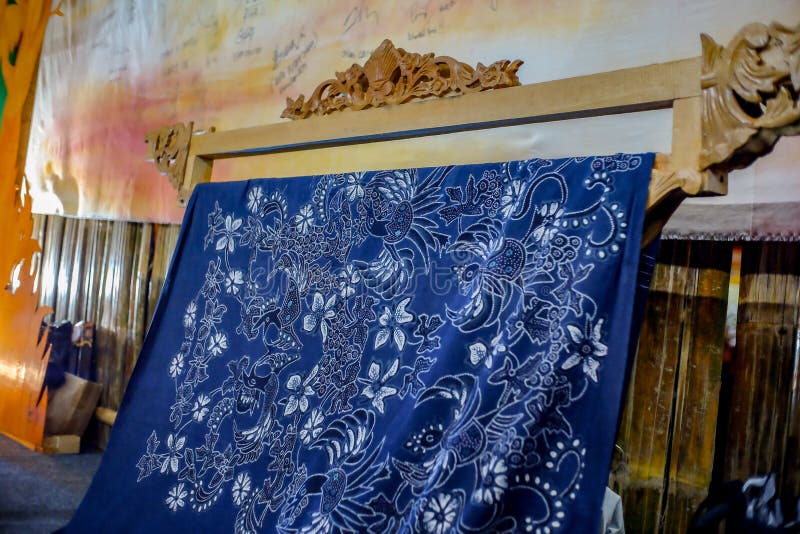
Locate an element on the screen. This screenshot has height=534, width=800. flooring is located at coordinates (38, 498).